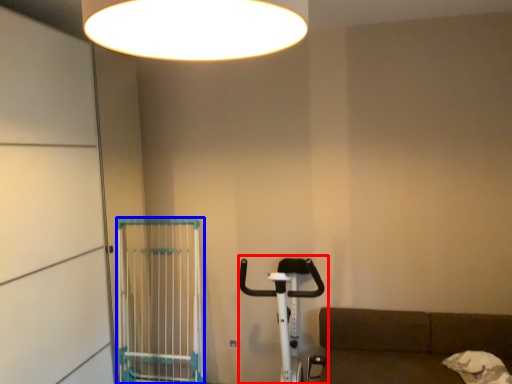
Question: Which of the following is the closest to the observer, baby carriage (highlighted by a red box) or cage (highlighted by a blue box)?

Choices:
 (A) baby carriage
 (B) cage

Answer: (A)